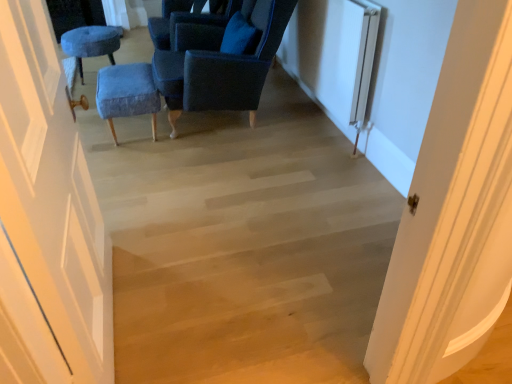
Question: In the image, is velvet blue ottoman at center, positioned as the first furniture in front-to-back order, positioned in front of or behind velvet blue ottoman at upper left, placed as the 1th furniture when sorted from back to front?

Choices:
 (A) behind
 (B) front

Answer: (B)

Question: From the image's perspective, relative to velvet blue ottoman at upper left, placed as the 1th furniture when sorted from back to front, is velvet blue ottoman at center, the 2th furniture when ordered from top to bottom, above or below?

Choices:
 (A) above
 (B) below

Answer: (B)

Question: Considering the real-world distances, which object is farthest from the velvet blue chair at center, placed as the second chair when sorted from back to front?

Choices:
 (A) velvet blue chair at upper center, the second chair viewed from the front
 (B) white matte door at left
 (C) velvet blue ottoman at upper left, placed as the 1th furniture when sorted from back to front
 (D) velvet blue ottoman at center, positioned as the first furniture in front-to-back order
 (E) white textured radiator at right

Answer: (B)

Question: Which of these objects is positioned closest to the velvet blue chair at center, placed as the second chair when sorted from back to front?

Choices:
 (A) white matte door at left
 (B) velvet blue chair at upper center, the second chair viewed from the front
 (C) velvet blue ottoman at center, which is the 2th furniture from back to front
 (D) velvet blue ottoman at upper left, the second furniture in the bottom-to-top sequence
 (E) white textured radiator at right

Answer: (B)